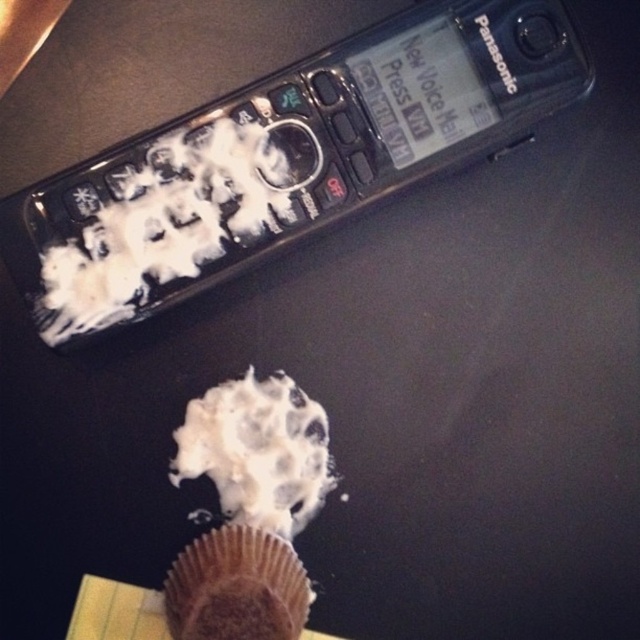
Can you confirm if white creamy frosting at center is thinner than brown matte muffin at lower center?

No, white creamy frosting at center is not thinner than brown matte muffin at lower center.

Which is behind, point (241, 506) or point (264, 568)?

Point (241, 506)

Who is more forward, [291,490] or [225,602]?

Positioned in front is point [225,602].

Where is `white creamy frosting at center`? white creamy frosting at center is located at coordinates (257, 451).